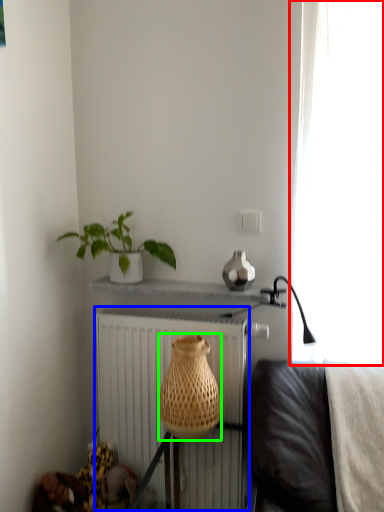
Question: Which is farther away from curtain (highlighted by a red box)? radiator (highlighted by a blue box) or basket (highlighted by a green box)?

Choices:
 (A) radiator
 (B) basket

Answer: (A)